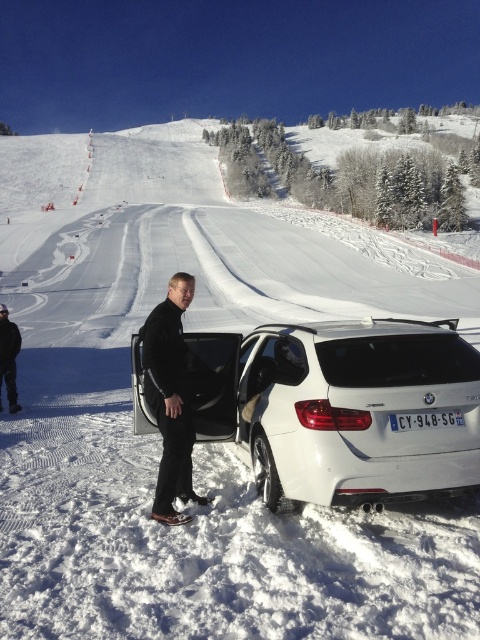
Who is lower down, white matte car at center or black softshell jacket at center?

Positioned lower is white matte car at center.

Which of these two, white matte car at center or black softshell jacket at center, stands shorter?

white matte car at center

Does point (273, 346) lie behind point (164, 308)?

Yes, point (273, 346) is farther from viewer.

Find the location of a particular element. white matte car at center is located at coordinates (343, 406).